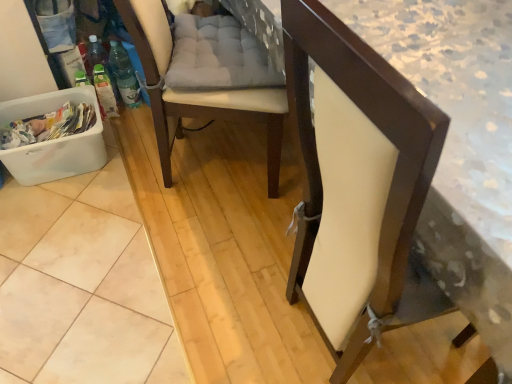
The height and width of the screenshot is (384, 512). What are the coordinates of `vacant area that lies between white leather chair at center, which is the first chair from left to right, and white plastic laundry basket at lower left` in the screenshot? It's located at (113, 169).